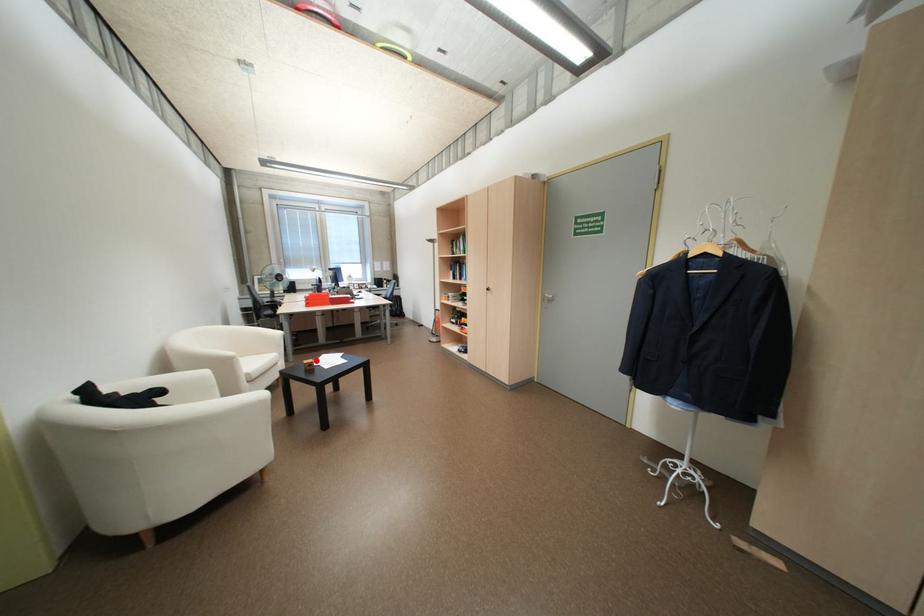
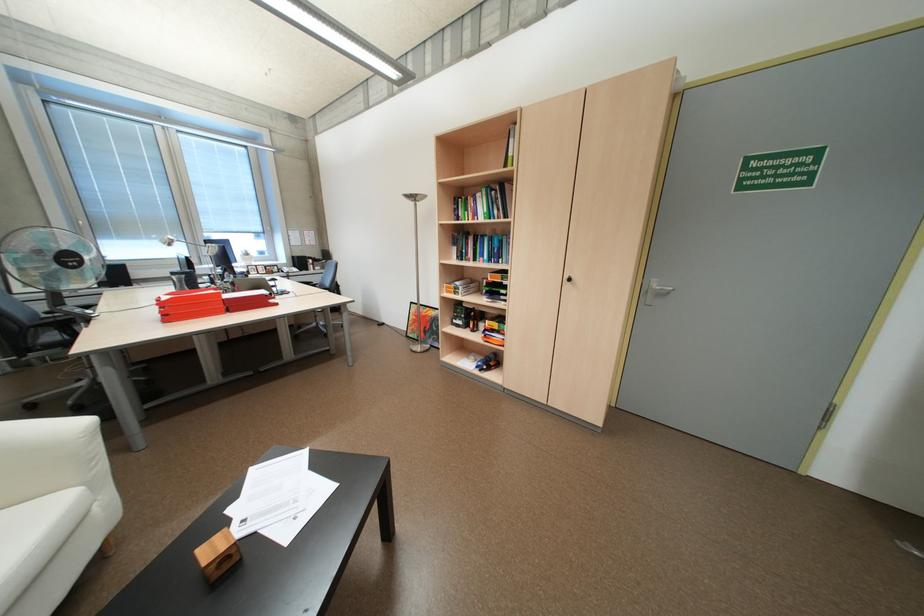
Question: I am providing you with two images of the same scene from different viewpoints. Image1 has a red point marked. In image2, the corresponding 3D location appears at what relative position? Reply with the corresponding letter.

Choices:
 (A) Closer
 (B) Farther

Answer: (B)